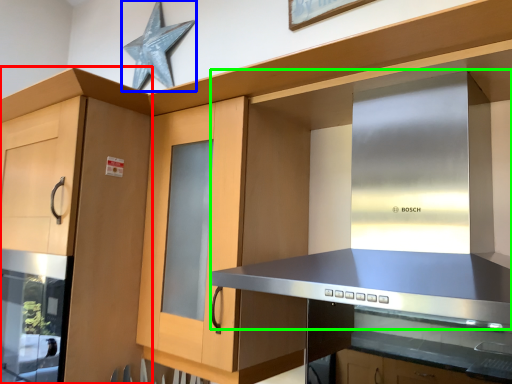
Question: Which is nearer to the cabinetry (highlighted by a red box)? star (highlighted by a blue box) or vent (highlighted by a green box).

Choices:
 (A) star
 (B) vent

Answer: (B)